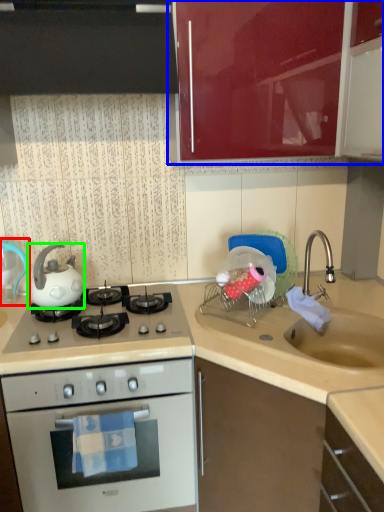
Question: Based on their relative distances, which object is farther from kitchen appliance (highlighted by a red box)? Choose from cabinetry (highlighted by a blue box) and tea pot (highlighted by a green box).

Choices:
 (A) cabinetry
 (B) tea pot

Answer: (A)